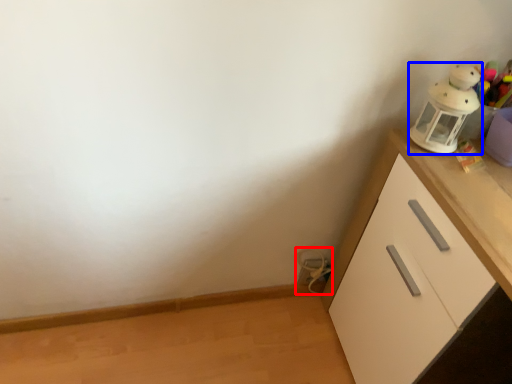
Question: Which of the following is the farthest to the observer, toy (highlighted by a red box) or toy (highlighted by a blue box)?

Choices:
 (A) toy
 (B) toy

Answer: (A)